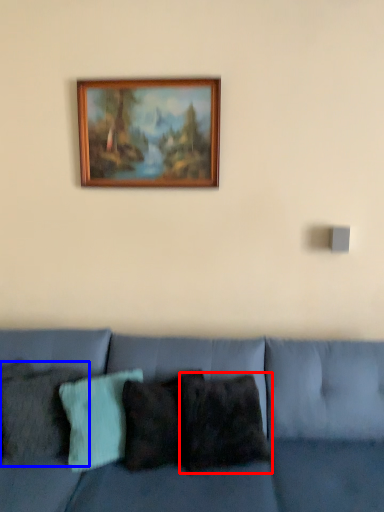
Question: Which point is further to the camera, pillow (highlighted by a red box) or pillow (highlighted by a blue box)?

Choices:
 (A) pillow
 (B) pillow

Answer: (A)